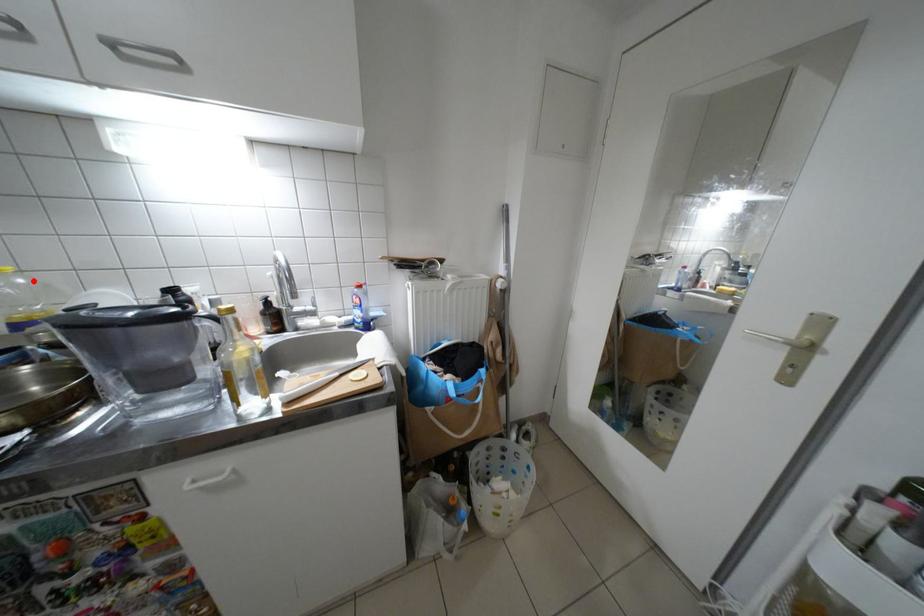
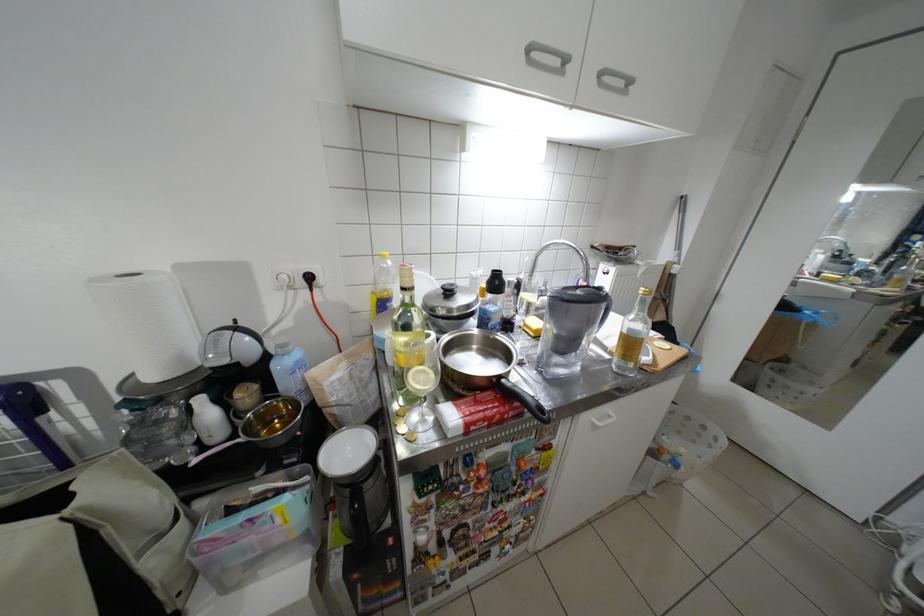
Where in the second image is the point corresponding to the highlighted location from the first image?

(400, 264)